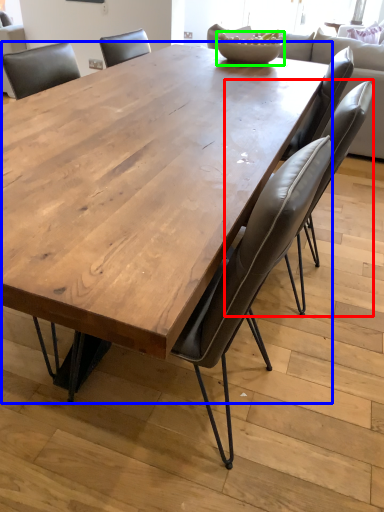
Question: Based on their relative distances, which object is nearer to chair (highlighted by a red box)? Choose from coffee table (highlighted by a blue box) and bowl (highlighted by a green box).

Choices:
 (A) coffee table
 (B) bowl

Answer: (A)